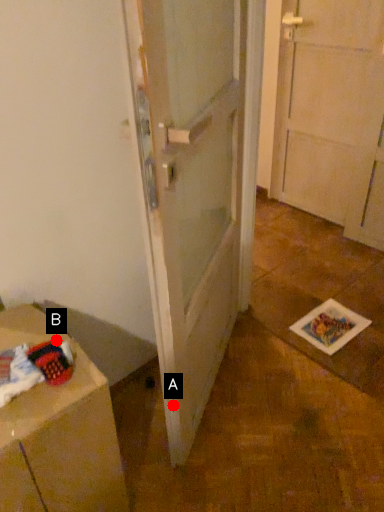
Question: Two points are circled on the image, labeled by A and B beside each circle. Which point is further to the camera?

Choices:
 (A) A is further
 (B) B is further

Answer: (A)